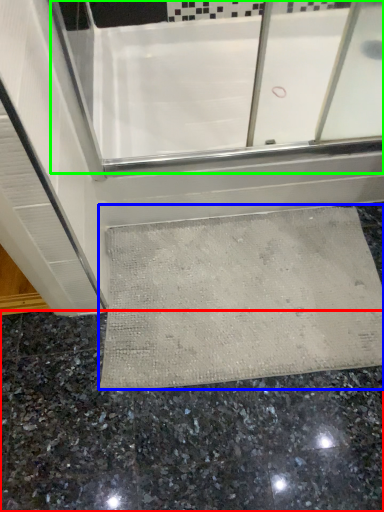
Question: Which object is positioned farthest from granite (highlighted by a red box)? Select from bath mat (highlighted by a blue box) and bath (highlighted by a green box).

Choices:
 (A) bath mat
 (B) bath

Answer: (B)